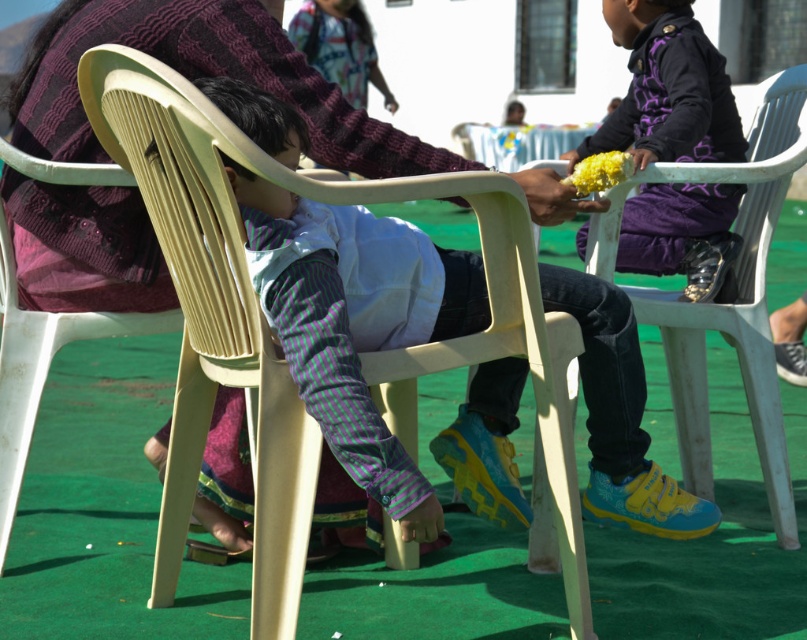
Looking at this image, you are a photographer trying to capture both the purple matte jacket at upper right and the matte yellow flower at upper right in a single frame. Given their sizes, which object should you focus on to ensure both fit clearly in the photo?

Since the purple matte jacket at upper right is bigger than the matte yellow flower at upper right, you should focus on the purple matte jacket at upper right to ensure both objects fit clearly in the photo.

You are a photographer trying to capture a closeup of the child in the foreground. You notice two points marked in the image. Which of these points, point 1 at coordinates (563, 179) or point 2 at coordinates (638, 150), is closer to your camera lens?

Point 1 at coordinates (563, 179) is closer to the camera lens than point 2 at coordinates (638, 150).